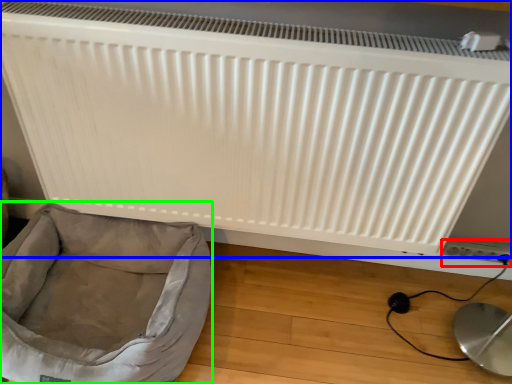
Question: Estimate the real-world distances between objects in this image. Which object is closer to electric outlet (highlighted by a red box), radiator (highlighted by a blue box) or dog bed (highlighted by a green box)?

Choices:
 (A) radiator
 (B) dog bed

Answer: (A)